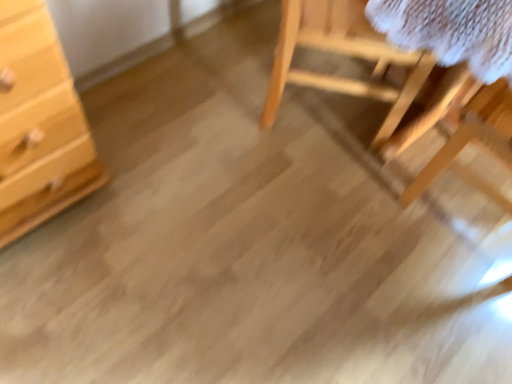
Find the location of a particular element. The image size is (512, 384). light wood chest of drawers at left is located at coordinates (40, 125).

This screenshot has width=512, height=384. What are the coordinates of `wooden table at right` in the screenshot? It's located at (455, 62).

Is natural wood chair at upper right situated inside wooden table at right or outside?

natural wood chair at upper right is not enclosed by wooden table at right.

Is point (318, 78) closer or farther from the camera than point (376, 15)?

Point (318, 78).

In the image, is natural wood chair at upper right on the left side or the right side of wooden table at right?

From the image, it's evident that natural wood chair at upper right is to the left of wooden table at right.

Considering the sizes of objects natural wood chair at upper right and wooden table at right in the image provided, who is taller, natural wood chair at upper right or wooden table at right?

wooden table at right is taller.

Between wooden table at right and natural wood chair at upper right, which one is positioned behind?

natural wood chair at upper right.

In terms of size, does wooden table at right appear bigger or smaller than natural wood chair at upper right?

In the image, wooden table at right appears to be larger than natural wood chair at upper right.

From the image's perspective, is wooden table at right on natural wood chair at upper right?

Incorrect, from the image's perspective, wooden table at right is lower than natural wood chair at upper right.

In terms of height, does light wood chest of drawers at left look taller or shorter compared to wooden table at right?

light wood chest of drawers at left is taller than wooden table at right.

Does light wood chest of drawers at left turn towards wooden table at right?

No, light wood chest of drawers at left is not facing towards wooden table at right.

Is light wood chest of drawers at left smaller than wooden table at right?

Correct, light wood chest of drawers at left occupies less space than wooden table at right.

From the image's perspective, is light wood chest of drawers at left on wooden table at right?

Yes, from the image's perspective, light wood chest of drawers at left is above wooden table at right.

From the image's perspective, between natural wood chair at upper right and light wood chest of drawers at left, who is located below?

From the image's view, light wood chest of drawers at left is below.

Consider the image. Considering the relative positions of natural wood chair at upper right and light wood chest of drawers at left in the image provided, is natural wood chair at upper right to the left of light wood chest of drawers at left from the viewer's perspective?

No.

Consider the image. Which object is closer to the camera taking this photo, natural wood chair at upper right or light wood chest of drawers at left?

light wood chest of drawers at left is closer to the camera.

From a real-world perspective, between natural wood chair at upper right and light wood chest of drawers at left, who is vertically higher?

From a 3D spatial view, light wood chest of drawers at left is above.

Could natural wood chair at upper right be considered to be inside light wood chest of drawers at left?

No, natural wood chair at upper right is located outside of light wood chest of drawers at left.

Is light wood chest of drawers at left aimed at natural wood chair at upper right?

No, light wood chest of drawers at left is not facing towards natural wood chair at upper right.

Can you confirm if light wood chest of drawers at left is smaller than natural wood chair at upper right?

Indeed, light wood chest of drawers at left has a smaller size compared to natural wood chair at upper right.

From a real-world perspective, is light wood chest of drawers at left over natural wood chair at upper right?

Yes, from a real-world perspective, light wood chest of drawers at left is above natural wood chair at upper right.

Who is bigger, wooden table at right or light wood chest of drawers at left?

A: wooden table at right is bigger.

Which is behind, point (393, 9) or point (12, 131)?

The point (393, 9) is farther.

In terms of height, does wooden table at right look taller or shorter compared to light wood chest of drawers at left?

wooden table at right is shorter than light wood chest of drawers at left.

From a real-world perspective, is wooden table at right above or below light wood chest of drawers at left?

wooden table at right is below light wood chest of drawers at left.

Find the location of a particular element. The width and height of the screenshot is (512, 384). table that appears in front of the natural wood chair at upper right is located at coordinates (455, 62).

You are a GUI agent. You are given a task and a screenshot of the screen. Output one action in this format:
    pyautogui.click(x=<x>, y=<y>)
    Task: Click on the furniture that is on the left side of wooden table at right
    This screenshot has width=512, height=384.
    Given the screenshot: What is the action you would take?
    pyautogui.click(x=362, y=57)

From the picture: Estimate the real-world distances between objects in this image. Which object is further from natural wood chair at upper right, wooden table at right or light wood chest of drawers at left?

The object further to natural wood chair at upper right is light wood chest of drawers at left.

Estimate the real-world distances between objects in this image. Which object is further from light wood chest of drawers at left, natural wood chair at upper right or wooden table at right?

wooden table at right is positioned further to the anchor light wood chest of drawers at left.

Based on their spatial positions, is wooden table at right or natural wood chair at upper right further from light wood chest of drawers at left?

wooden table at right.

Estimate the real-world distances between objects in this image. Which object is further from natural wood chair at upper right, light wood chest of drawers at left or wooden table at right?

The object further to natural wood chair at upper right is light wood chest of drawers at left.

Considering their positions, is light wood chest of drawers at left positioned further to wooden table at right than natural wood chair at upper right?

Among the two, light wood chest of drawers at left is located further to wooden table at right.

In the scene shown: Based on their spatial positions, is natural wood chair at upper right or light wood chest of drawers at left closer to wooden table at right?

Among the two, natural wood chair at upper right is located nearer to wooden table at right.

Identify the location of furniture between light wood chest of drawers at left and wooden table at right from left to right. (362, 57).